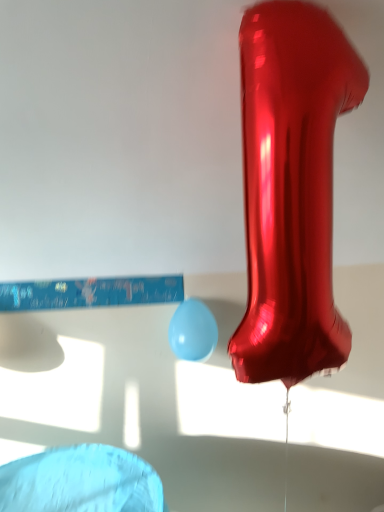
Question: Considering the positions of shiny metallic number one at center and light blue glossy balloon at center in the image, is shiny metallic number one at center bigger or smaller than light blue glossy balloon at center?

Choices:
 (A) small
 (B) big

Answer: (B)

Question: Is shiny metallic number one at center in front of or behind light blue glossy balloon at center in the image?

Choices:
 (A) behind
 (B) front

Answer: (B)

Question: Visually, is shiny metallic number one at center positioned to the left or to the right of light blue glossy balloon at center?

Choices:
 (A) left
 (B) right

Answer: (B)

Question: Is light blue glossy balloon at center bigger or smaller than shiny metallic number one at center?

Choices:
 (A) big
 (B) small

Answer: (B)

Question: From a real-world perspective, relative to shiny metallic number one at center, is light blue glossy balloon at center vertically above or below?

Choices:
 (A) above
 (B) below

Answer: (B)

Question: From the image's perspective, is light blue glossy balloon at center located above or below shiny metallic number one at center?

Choices:
 (A) above
 (B) below

Answer: (B)

Question: Is point (180, 309) closer or farther from the camera than point (304, 257)?

Choices:
 (A) closer
 (B) farther

Answer: (B)